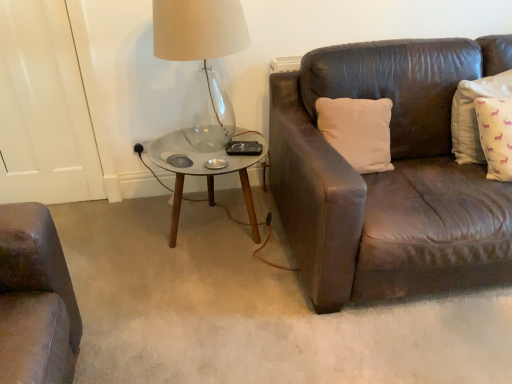
Question: Does point (344, 127) appear closer or farther from the camera than point (164, 52)?

Choices:
 (A) closer
 (B) farther

Answer: (B)

Question: In the image, is white matte pillow at upper right, which is the 2th pillow from right to left, positioned in front of or behind transparent glass table lamp at upper left?

Choices:
 (A) front
 (B) behind

Answer: (B)

Question: Which object is the closest to the transparent glass table lamp at upper left?

Choices:
 (A) yellow cotton pillow at right, placed as the 1th pillow when sorted from right to left
 (B) metallic glass coffee table at center
 (C) white matte pillow at upper right, which is the 2th pillow from right to left

Answer: (B)

Question: Considering the real-world distances, which object is farthest from the white matte pillow at upper right, which is the 2th pillow from right to left?

Choices:
 (A) transparent glass table lamp at upper left
 (B) yellow cotton pillow at right, which ranks as the second pillow in left-to-right order
 (C) metallic glass coffee table at center

Answer: (A)